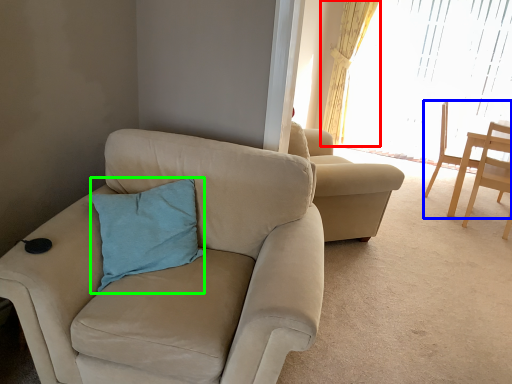
Question: Which object is the closest to the curtain (highlighted by a red box)? Choose among these: chair (highlighted by a blue box) or pillow (highlighted by a green box).

Choices:
 (A) chair
 (B) pillow

Answer: (A)